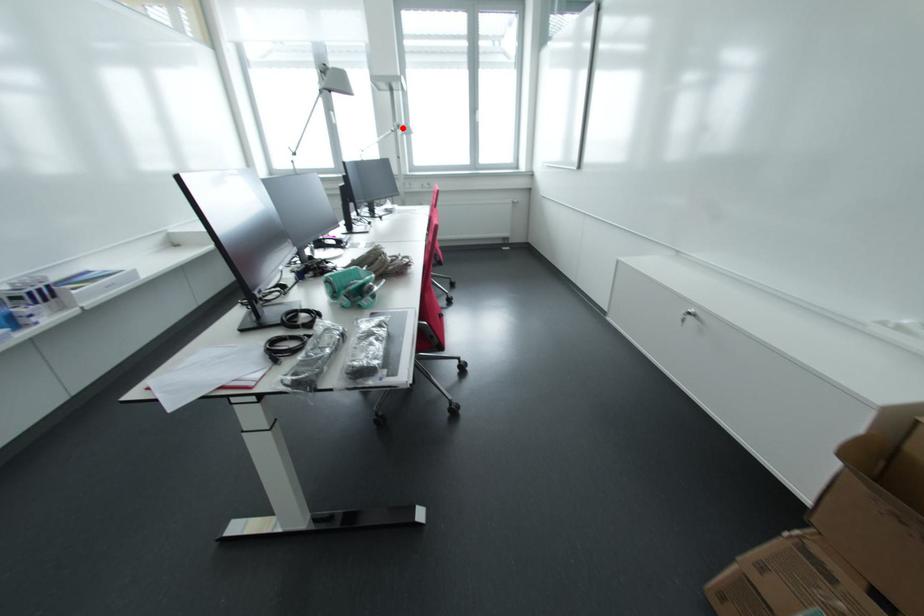
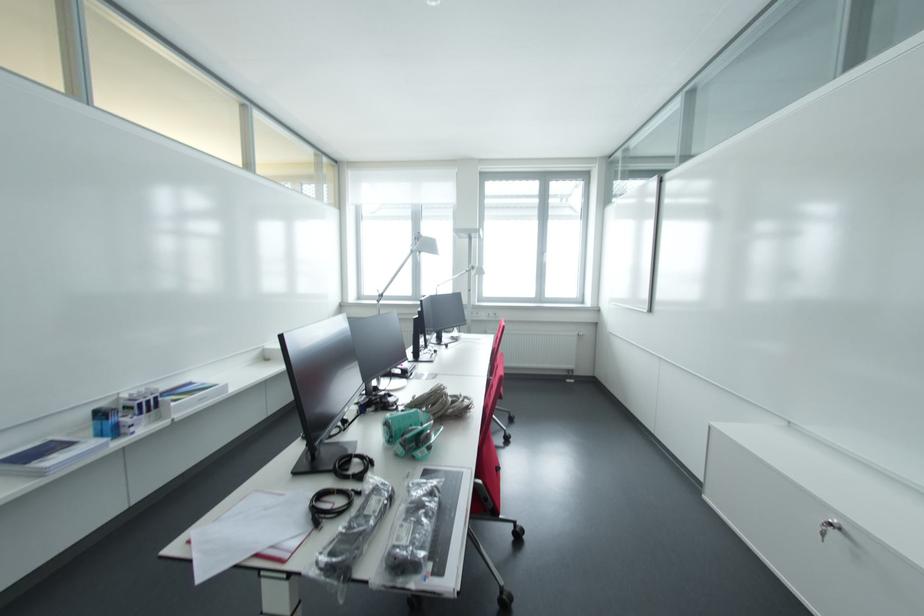
Question: I am providing you with two images of the same scene from different viewpoints. In image1, a red point is highlighted. Considering the same 3D point in image2, which of the following is correct?

Choices:
 (A) It is closer
 (B) It is farther

Answer: (B)